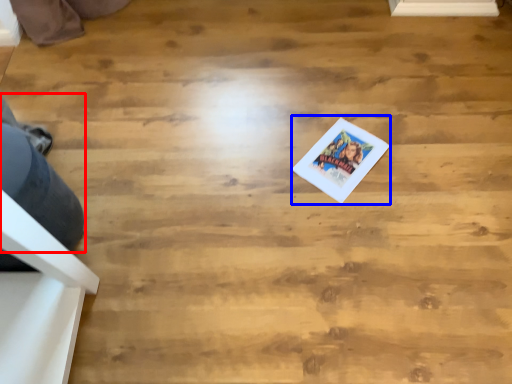
Question: Which object appears closest to the camera in this image, person (highlighted by a red box) or postcard (highlighted by a blue box)?

Choices:
 (A) person
 (B) postcard

Answer: (A)